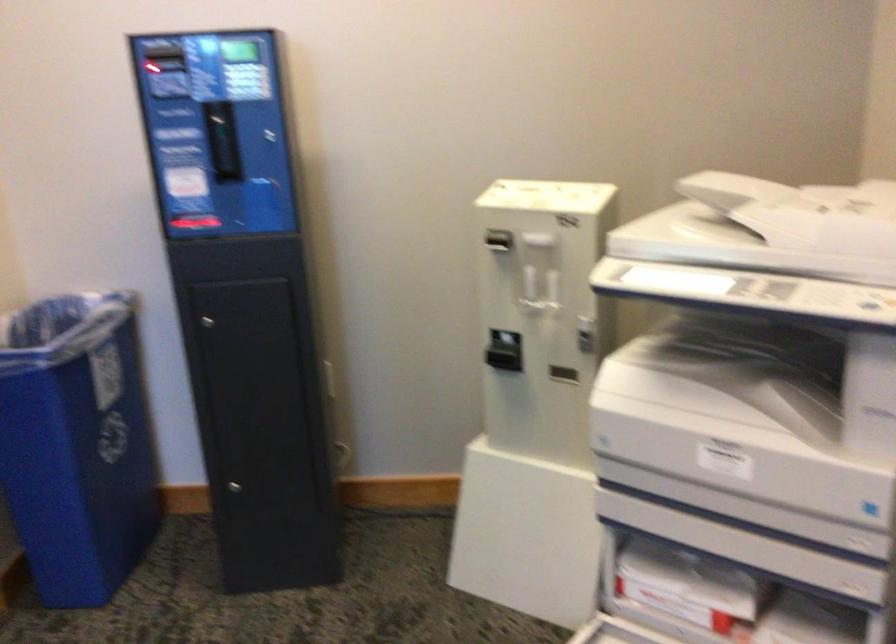
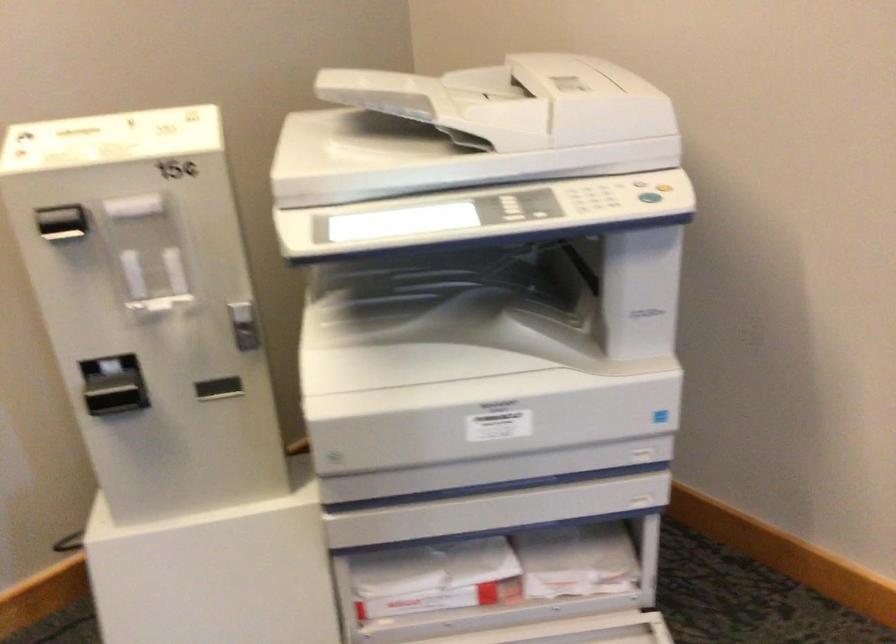
The point at (494, 241) is marked in the first image. Where is the corresponding point in the second image?

(62, 223)